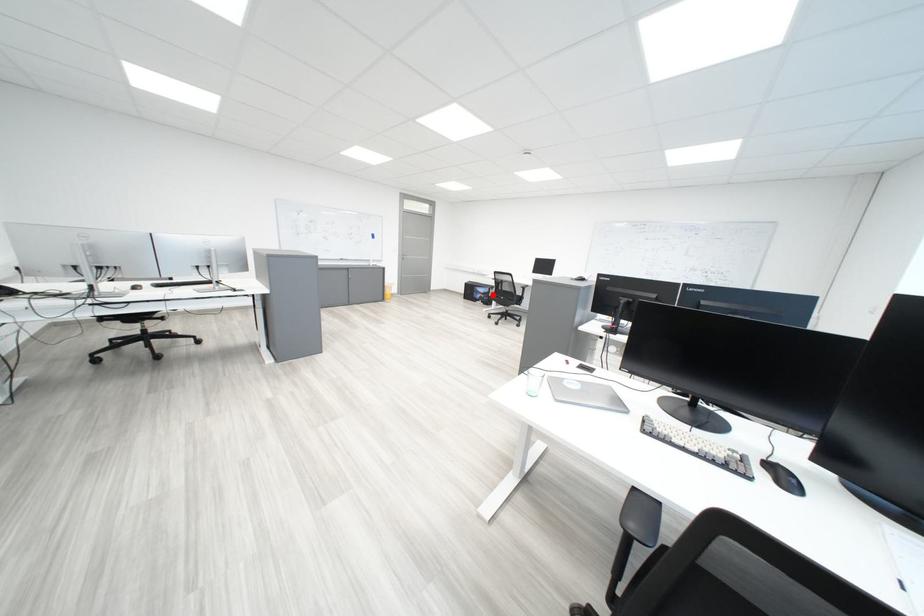
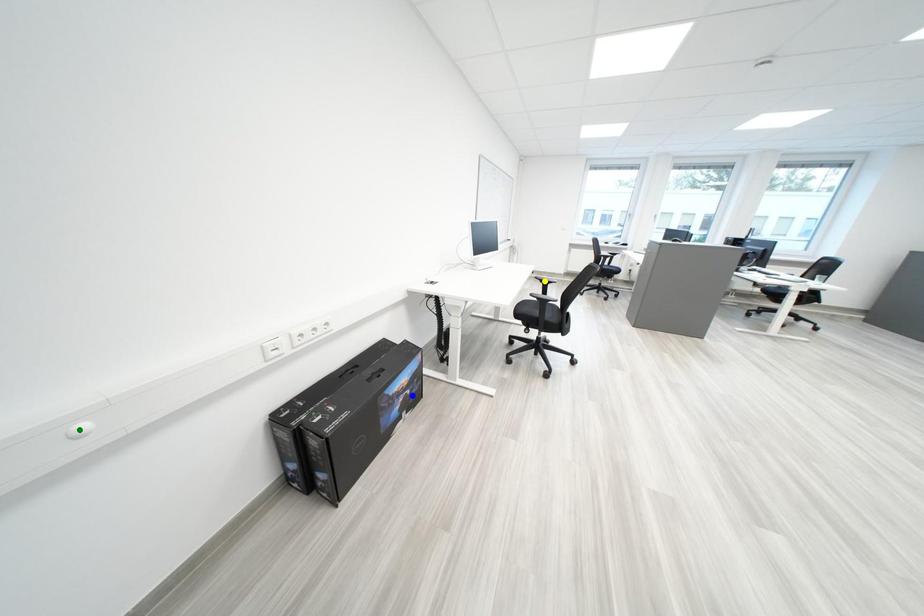
Question: I am providing you with two images of the same scene from different viewpoints. A red point is marked on the first image. You are given multiple points on the second image. Can you choose the point in image 2 that corresponds to the point in image 1?

Choices:
 (A) yellow point
 (B) green point
 (C) blue point

Answer: (C)